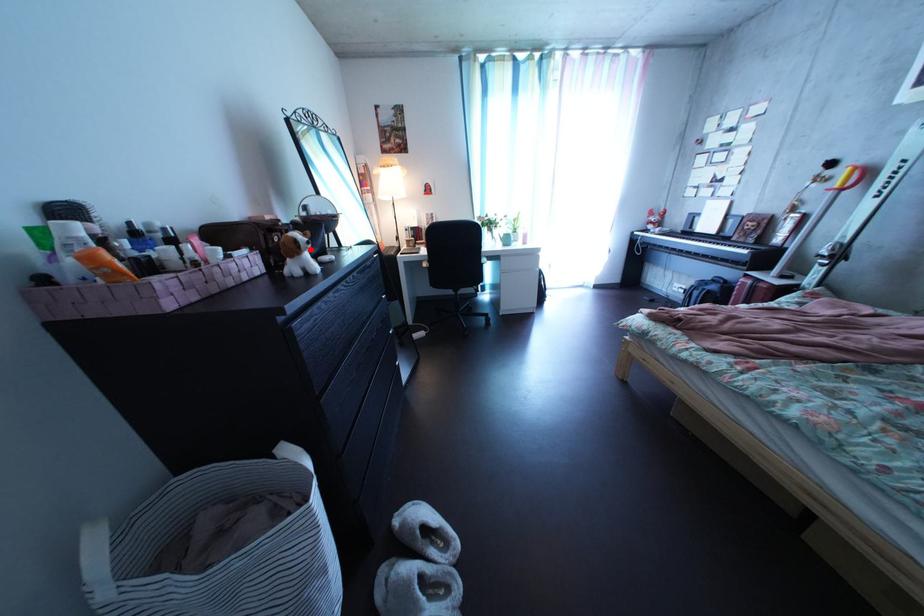
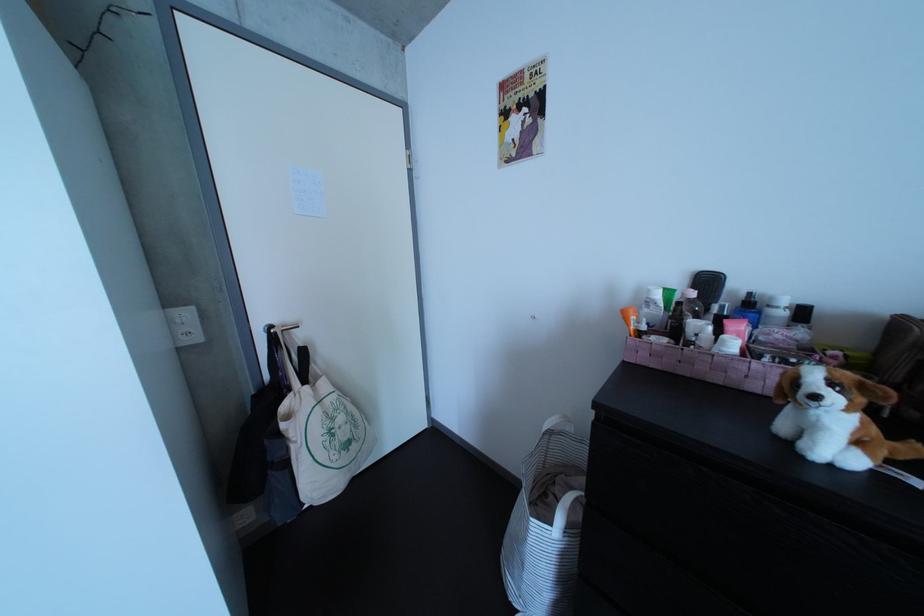
Locate, in the second image, the point that corresponds to the highlighted location in the first image.

(809, 389)